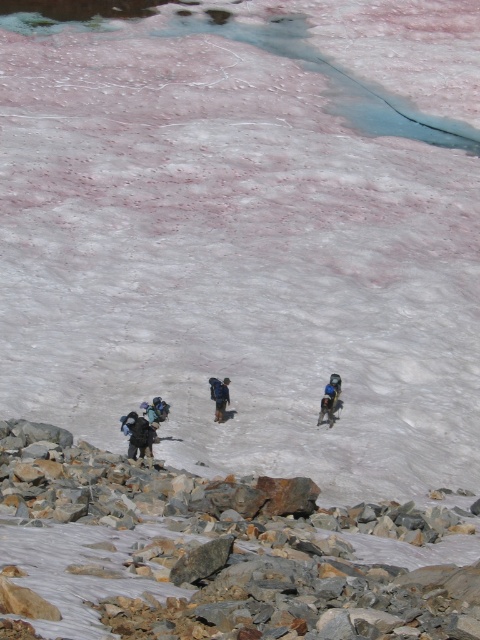
Question: Can you confirm if gray rock at lower left is bigger than dark blue backpack at center?

Choices:
 (A) yes
 (B) no

Answer: (A)

Question: Which of the following is the closest to the observer?

Choices:
 (A) (219, 595)
 (B) (219, 412)
 (C) (324, 387)

Answer: (A)

Question: Can you confirm if gray rock at lower left is bigger than blue fabric backpack at center-right?

Choices:
 (A) no
 (B) yes

Answer: (B)

Question: Which point is farther to the camera?

Choices:
 (A) dark blue jacket at lower left
 (B) blue fabric backpack at center-right
 (C) dark blue backpack at center
 (D) gray rock at lower left

Answer: (B)

Question: Which point is farther to the camera?

Choices:
 (A) gray rock at lower left
 (B) blue fabric backpack at center-right
 (C) dark blue jacket at lower left

Answer: (B)

Question: Can you confirm if gray rock at lower left is thinner than blue fabric backpack at center-right?

Choices:
 (A) yes
 (B) no

Answer: (B)